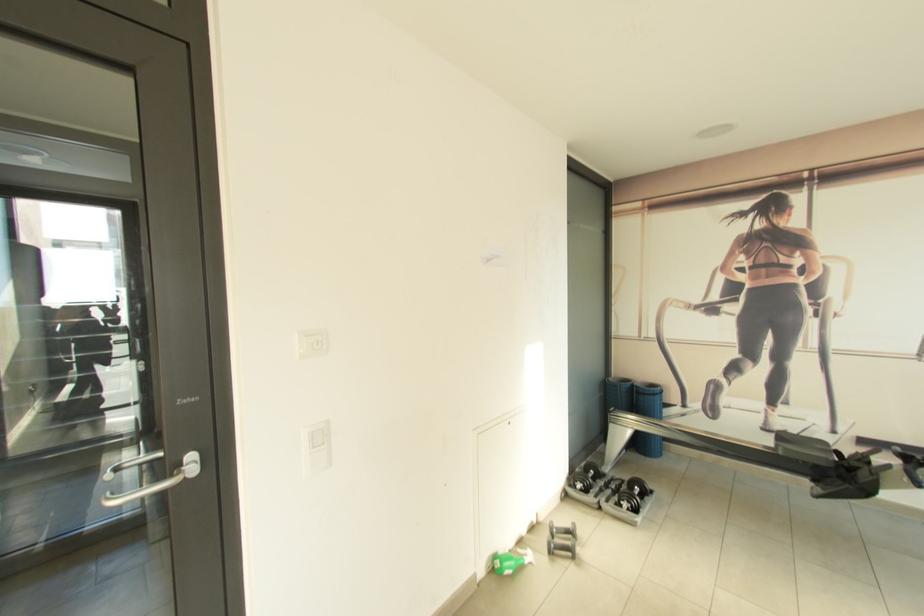
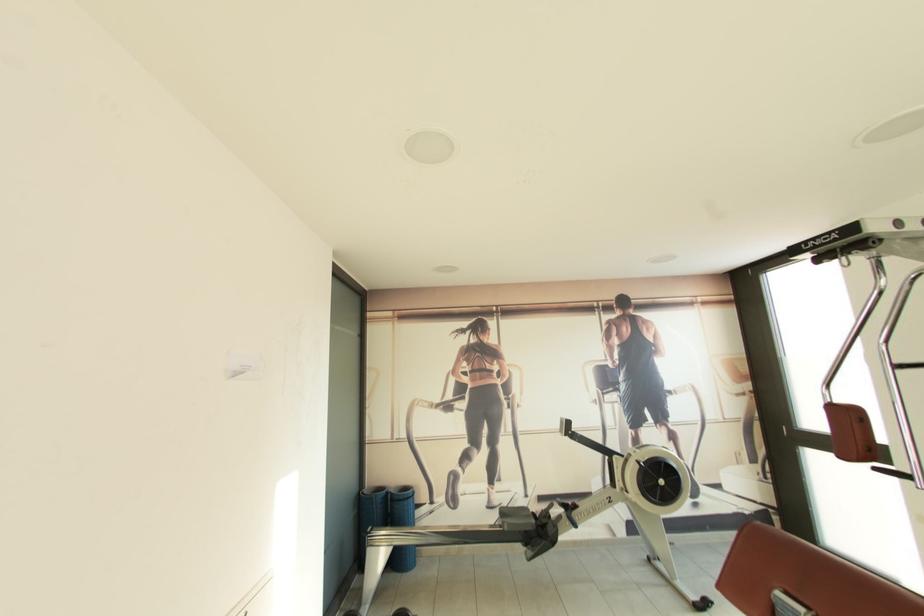
In the second image, find the point that corresponds to (658,387) in the first image.

(410, 490)